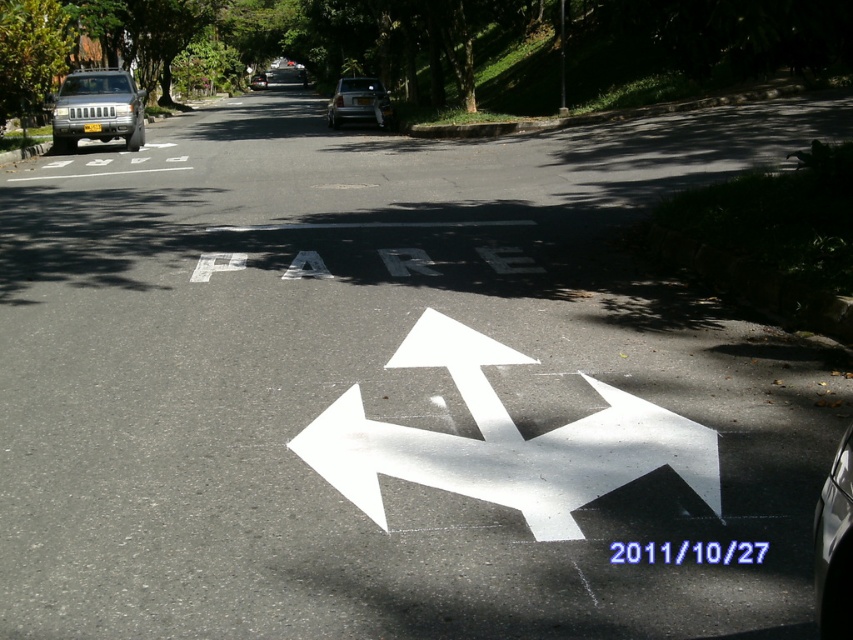
Question: Observing the image, what is the correct spatial positioning of white painted arrow at center in reference to glossy silver car at lower right?

Choices:
 (A) right
 (B) left

Answer: (B)

Question: Is glossy silver car at lower right bigger than silver metallic car at center?

Choices:
 (A) yes
 (B) no

Answer: (B)

Question: Which point is farther to the camera?

Choices:
 (A) silver metallic car at center
 (B) white painted arrow at center
 (C) glossy silver car at lower right
 (D) white glossy car at center

Answer: (A)

Question: Is glossy silver car at lower right further to the viewer compared to silver metallic car at center?

Choices:
 (A) no
 (B) yes

Answer: (A)

Question: Which point is closer to the camera taking this photo?

Choices:
 (A) (254, 83)
 (B) (123, 102)

Answer: (B)

Question: Which point appears closest to the camera in this image?

Choices:
 (A) (846, 467)
 (B) (405, 336)
 (C) (132, 109)
 (D) (254, 76)

Answer: (A)